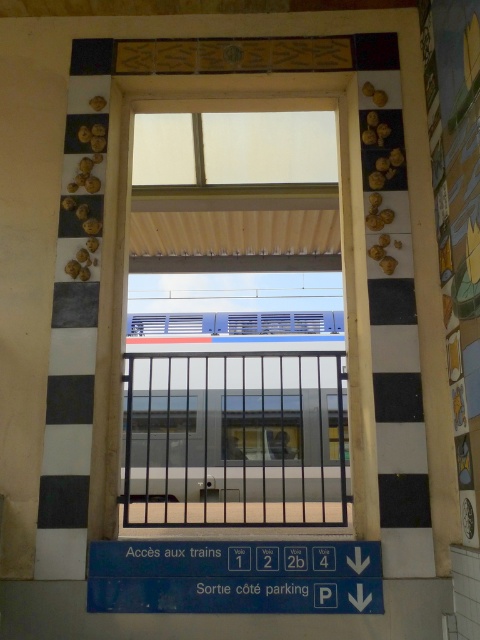
Question: Does white glass window at upper center have a lesser width compared to transparent glass train at center?

Choices:
 (A) no
 (B) yes

Answer: (A)

Question: Which of the following is the farthest from the observer?

Choices:
 (A) (292, 177)
 (B) (288, 444)
 (C) (238, 433)

Answer: (C)

Question: Which object is farther from the camera taking this photo?

Choices:
 (A) transparent glass train at center
 (B) silver metallic rail at center

Answer: (A)

Question: Is the position of silver metallic rail at center more distant than that of white glass window at upper center?

Choices:
 (A) yes
 (B) no

Answer: (A)

Question: Among these points, which one is farthest from the camera?

Choices:
 (A) (169, 396)
 (B) (265, 173)

Answer: (A)

Question: Where is silver metallic rail at center located in relation to transparent glass train at center in the image?

Choices:
 (A) below
 (B) above

Answer: (A)